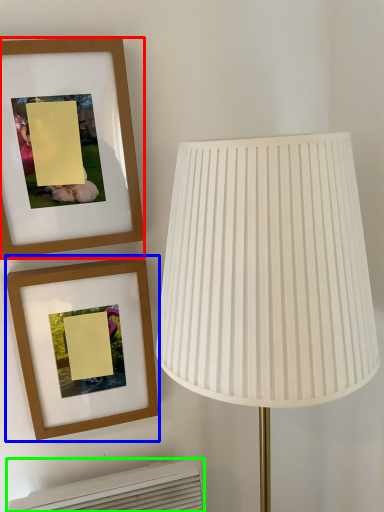
Question: Estimate the real-world distances between objects in this image. Which object is farther from picture frame (highlighted by a red box), picture frame (highlighted by a blue box) or air conditioner (highlighted by a green box)?

Choices:
 (A) picture frame
 (B) air conditioner

Answer: (B)